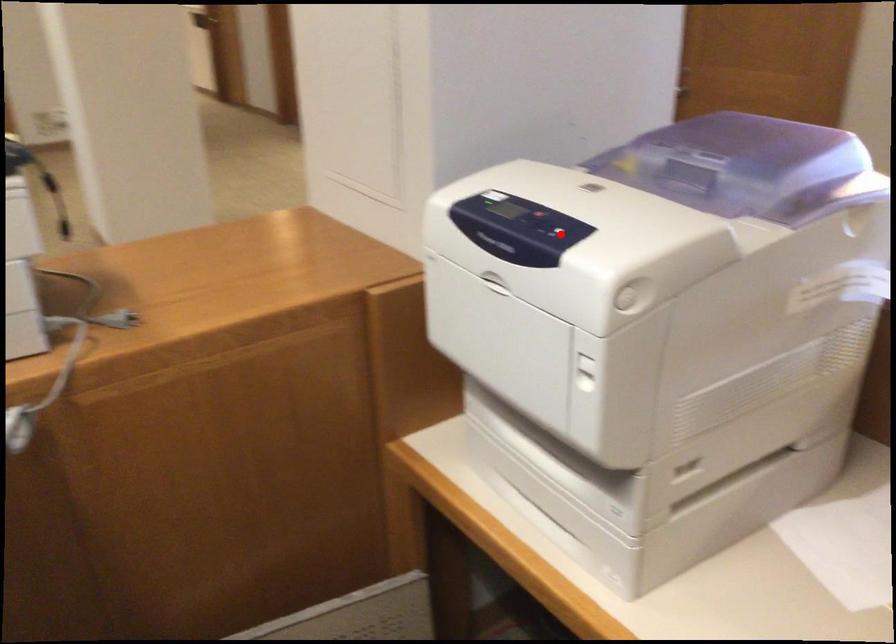
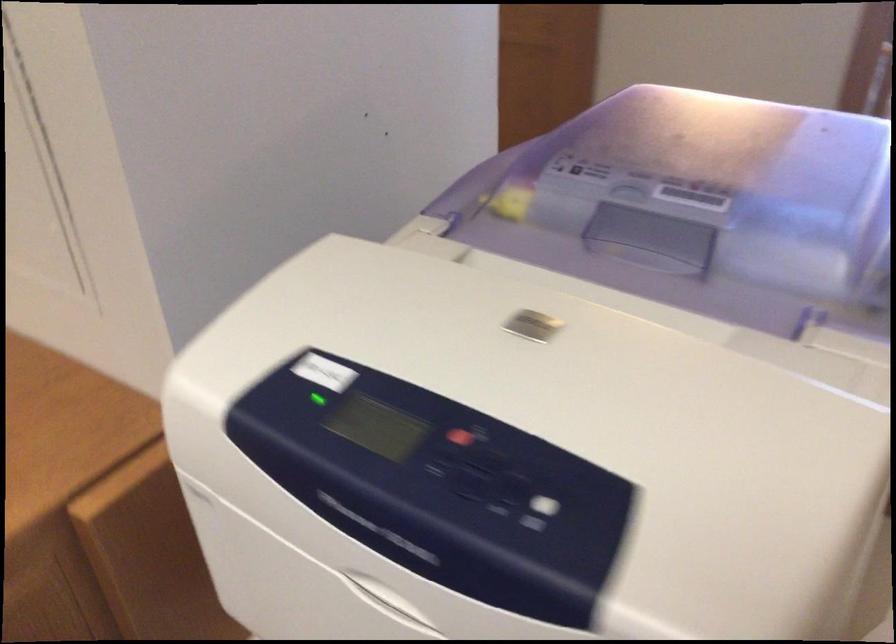
Where in the second image is the point corresponding to the highlighted location from the first image?

(538, 512)